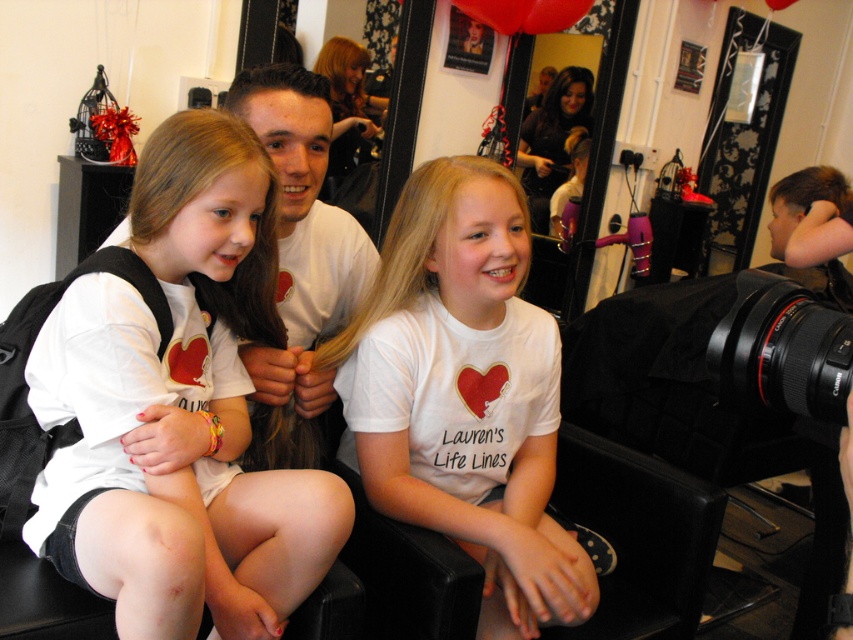
Does blonde smooth hair at left appear on the right side of dark brown hair at center?

In fact, blonde smooth hair at left is to the left of dark brown hair at center.

Which is behind, point (138, 184) or point (526, 148)?

The point (526, 148) is more distant.

Who is more forward, (x=144, y=148) or (x=538, y=186)?

Point (x=144, y=148) is more forward.

The image size is (853, 640). In order to click on blonde smooth hair at left in this screenshot , I will do `click(200, 193)`.

Locate an element on the screen. blonde silky hair at center is located at coordinates (413, 244).

Between blonde silky hair at center and blonde smooth hair at upper right, which one appears on the left side from the viewer's perspective?

Positioned to the left is blonde silky hair at center.

Between point (427, 256) and point (792, 202), which one is positioned behind?

The point (792, 202) is behind.

Find the location of a particular element. Image resolution: width=853 pixels, height=640 pixels. blonde silky hair at center is located at coordinates (413, 244).

Which is above, white cotton shirt at center or blonde smooth hair at left?

blonde smooth hair at left

Which is in front, point (549, 600) or point (213, 291)?

Point (549, 600) is in front.

The width and height of the screenshot is (853, 640). I want to click on white cotton shirt at center, so click(463, 392).